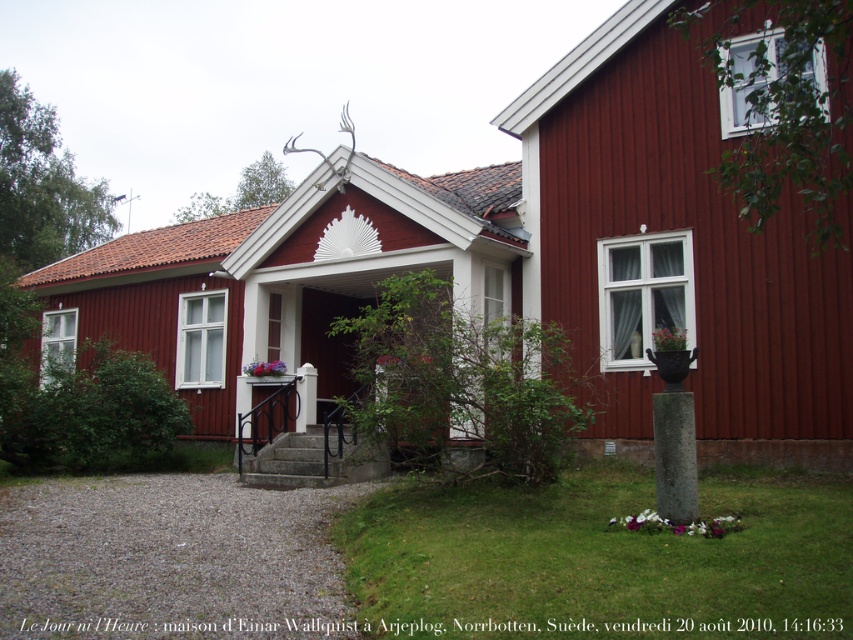
Question: Can you confirm if matte wooden cottage at center is positioned above white concrete pillar at center?

Choices:
 (A) no
 (B) yes

Answer: (B)

Question: Which point is farther from the camera taking this photo?

Choices:
 (A) (276, 436)
 (B) (682, 392)
 (C) (653, 120)
 (D) (302, 401)

Answer: (D)

Question: Does matte wooden cottage at center have a lesser width compared to concrete stairs at center?

Choices:
 (A) yes
 (B) no

Answer: (B)

Question: Is matte wooden cottage at center to the left of white concrete pillar at center from the viewer's perspective?

Choices:
 (A) yes
 (B) no

Answer: (A)

Question: Which of the following is the farthest from the observer?

Choices:
 (A) concrete stairs at center
 (B) white concrete pillar at center
 (C) matte wooden cottage at center

Answer: (B)

Question: Considering the real-world distances, which object is farthest from the concrete stairs at center?

Choices:
 (A) gray stone pillar at lower right
 (B) white concrete pillar at center

Answer: (A)